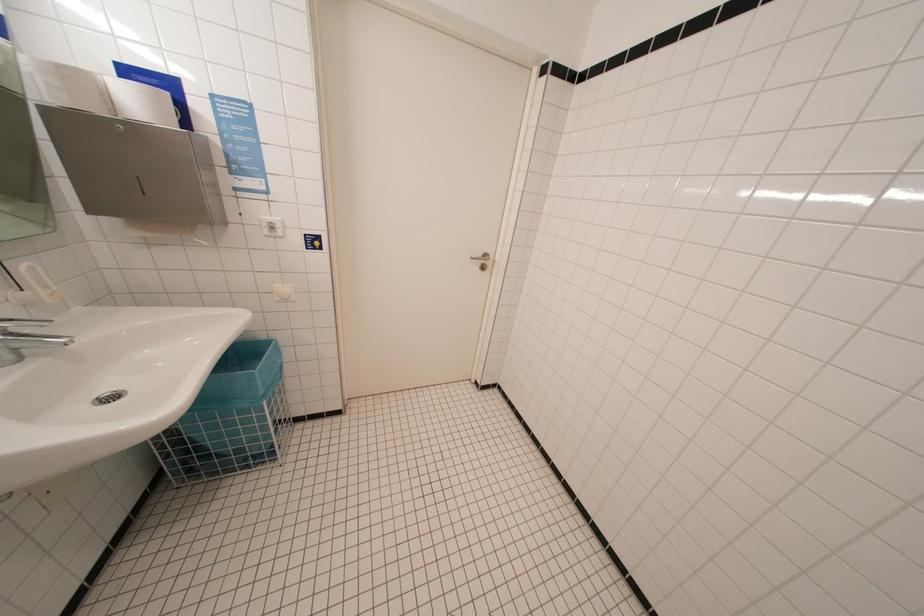
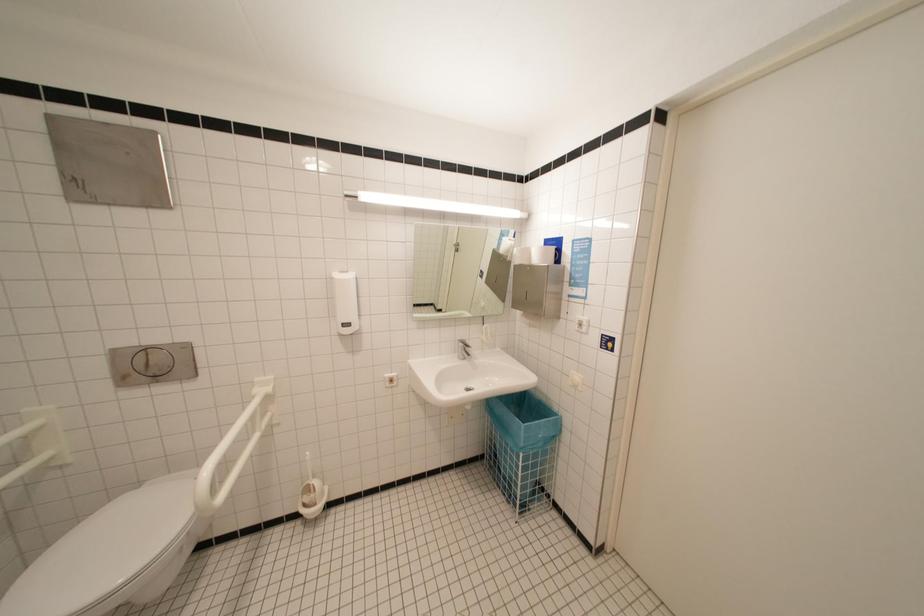
Question: The first image is from the beginning of the video and the second image is from the end. How did the camera likely rotate when shooting the video?

Choices:
 (A) Left
 (B) Right
 (C) Up
 (D) Down

Answer: (A)